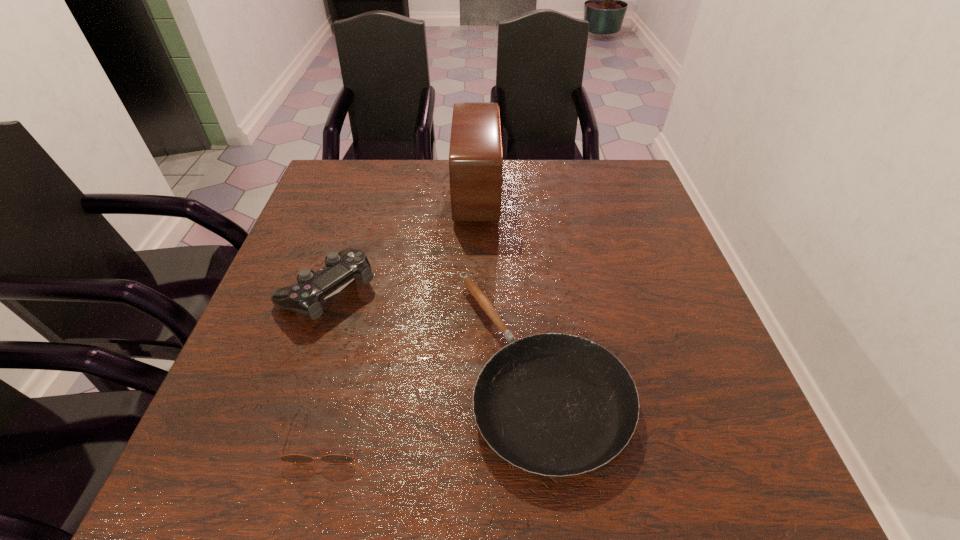
Where is `frying pan present at the near edge`? frying pan present at the near edge is located at coordinates (553, 404).

Locate an element on the screen. Image resolution: width=960 pixels, height=540 pixels. sunglasses at the near edge is located at coordinates (293, 458).

You are a GUI agent. You are given a task and a screenshot of the screen. Output one action in this format:
    pyautogui.click(x=<x>, y=<y>)
    Task: Click on the control situated at the left edge
    
    Given the screenshot: What is the action you would take?
    pyautogui.click(x=306, y=297)

Where is `sunglasses that is at the left edge`? This screenshot has height=540, width=960. sunglasses that is at the left edge is located at coordinates (293, 458).

The width and height of the screenshot is (960, 540). Find the location of `object at the near left corner`. object at the near left corner is located at coordinates pos(293,458).

This screenshot has width=960, height=540. In order to click on free space at the far edge of the desktop in this screenshot , I will do `click(541, 181)`.

In the image, there is a desktop. Where is `vacant space at the left edge`? The width and height of the screenshot is (960, 540). vacant space at the left edge is located at coordinates (268, 311).

Identify the location of free region at the right edge. (631, 239).

Where is `blank space at the near left corner`? This screenshot has width=960, height=540. blank space at the near left corner is located at coordinates (272, 492).

In order to click on vacant area at the far right corner of the desktop in this screenshot , I will do `click(608, 185)`.